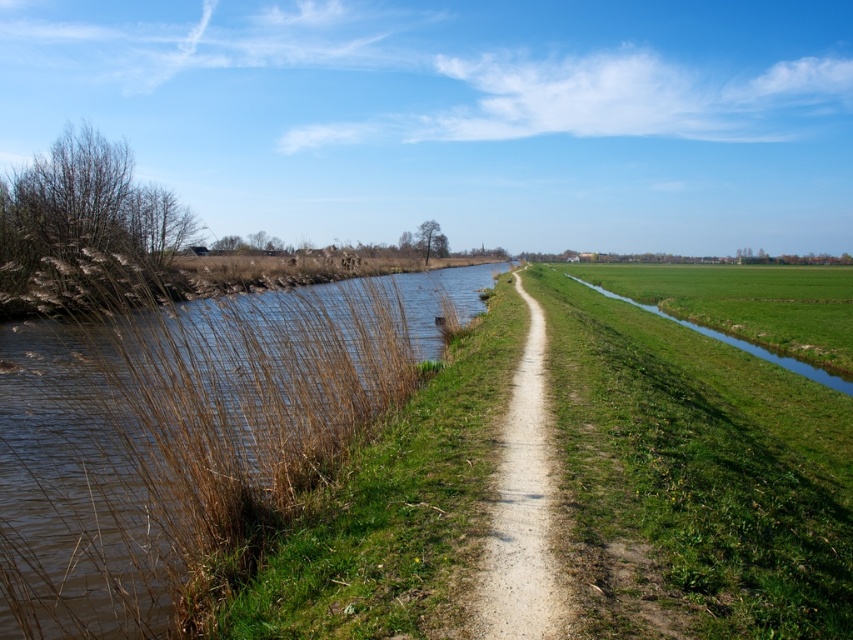
Question: Which object is closer to the camera taking this photo?

Choices:
 (A) dirt/gravel path at center
 (B) green grass at right
 (C) brown grassy stream at left

Answer: (A)

Question: Among these objects, which one is nearest to the camera?

Choices:
 (A) green grass at right
 (B) brown grassy stream at left
 (C) dirt/gravel path at center

Answer: (C)

Question: Which of the following is the farthest from the observer?

Choices:
 (A) brown grassy stream at left
 (B) green grass at right

Answer: (A)

Question: Is brown grassy stream at left positioned at the back of dirt/gravel path at center?

Choices:
 (A) no
 (B) yes

Answer: (B)

Question: Does green grass at right have a smaller size compared to dirt/gravel path at center?

Choices:
 (A) yes
 (B) no

Answer: (B)

Question: Can you confirm if green grass at right is wider than dirt/gravel path at center?

Choices:
 (A) no
 (B) yes

Answer: (B)